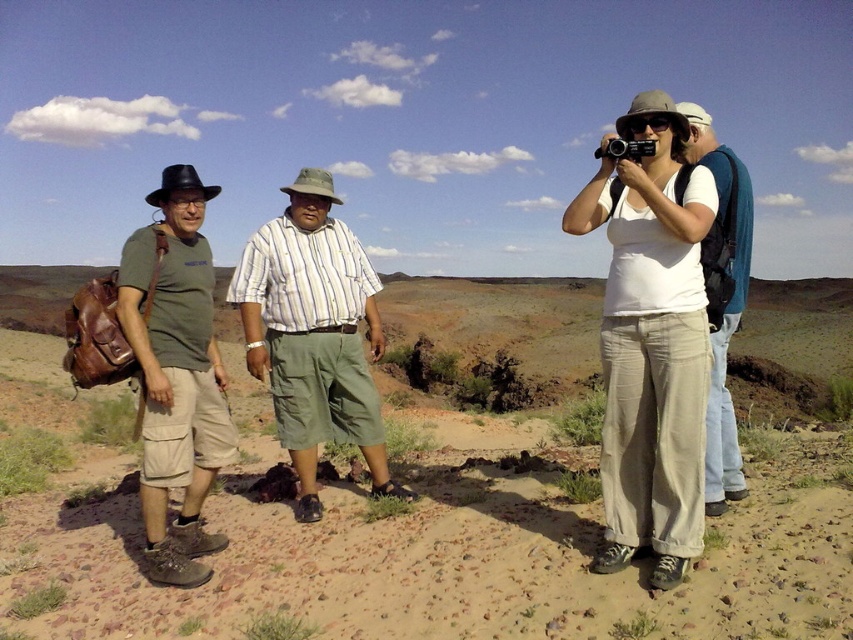
Based on the photo, you are planning to set up a picnic in the desert scene. The picnic blanket is the size of the striped cotton shirt at center. Will the brown dirt field at center provide enough space for the blanket?

The brown dirt field at center might be wider than striped cotton shirt at center, so it could potentially accommodate the picnic blanket.

In the desert scene, you see a brown dirt field at center and a striped cotton shirt at center. Which object is positioned to the left?

The brown dirt field at center is to the left of the striped cotton shirt at center.